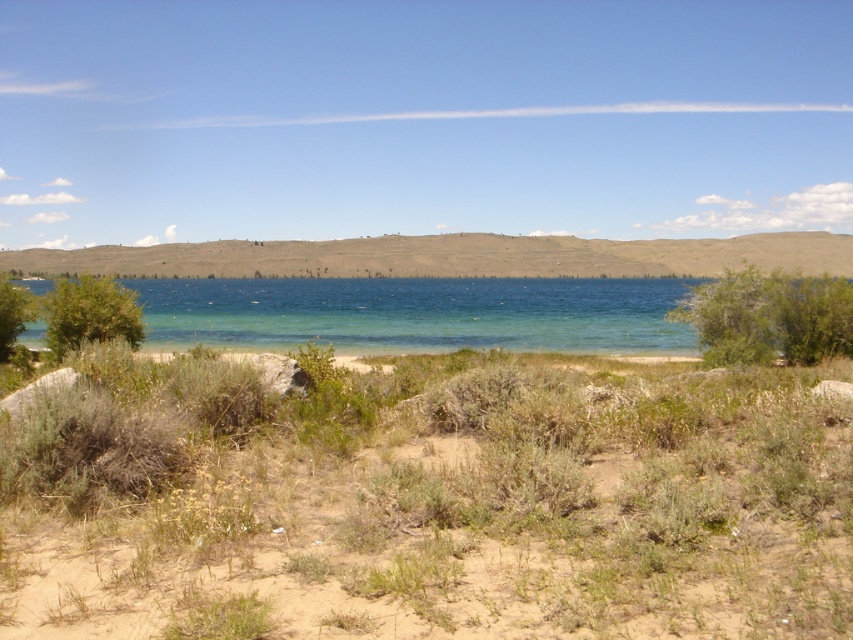
Is brown sandy soil at lower center above green leafy bush at left?

No, brown sandy soil at lower center is not above green leafy bush at left.

Does brown sandy soil at lower center appear under green leafy bush at left?

Indeed, brown sandy soil at lower center is positioned under green leafy bush at left.

Measure the distance between point (527, 609) and camera.

5.65 meters

Identify the location of brown sandy soil at lower center. The width and height of the screenshot is (853, 640). (428, 502).

Describe the element at coordinates (90, 314) in the screenshot. The width and height of the screenshot is (853, 640). I see `green leafy bush at left` at that location.

Between green leafy bush at left and green leafy bush at lower left, which one has less height?

green leafy bush at left

I want to click on green leafy bush at left, so click(x=90, y=314).

Which is more to the right, brown sandy soil at lower center or green leafy bush at lower left?

brown sandy soil at lower center

Between point (747, 408) and point (3, 300), which one is positioned in front?

Point (747, 408)

The width and height of the screenshot is (853, 640). I want to click on brown sandy soil at lower center, so click(428, 502).